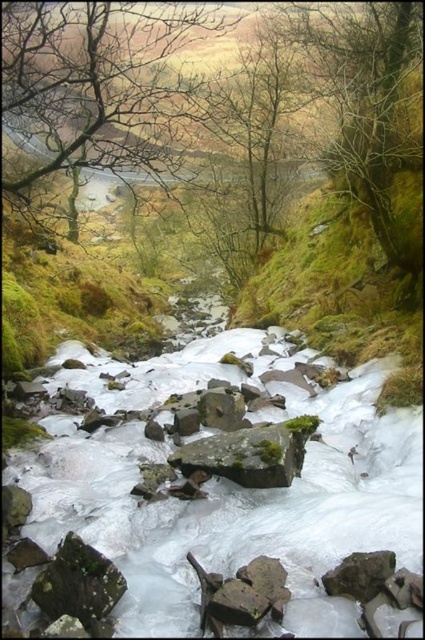
Which of these two, white frosty rocks at center or green mossy rock at center, stands taller?

green mossy rock at center is taller.

Does white frosty rocks at center lie in front of green mossy rock at center?

Yes, white frosty rocks at center is in front of green mossy rock at center.

The width and height of the screenshot is (425, 640). What do you see at coordinates (227, 486) in the screenshot?
I see `white frosty rocks at center` at bounding box center [227, 486].

The width and height of the screenshot is (425, 640). Identify the location of white frosty rocks at center. (227, 486).

Can you confirm if white frosty rocks at center is positioned to the right of mossy gray rock at lower left?

In fact, white frosty rocks at center is to the left of mossy gray rock at lower left.

Between white frosty rocks at center and mossy gray rock at lower left, which one is positioned lower?

white frosty rocks at center

Where is `white frosty rocks at center`? The image size is (425, 640). white frosty rocks at center is located at coordinates (227, 486).

Is brown leafless tree at upper left smaller than gray/rough stone at center?

No, brown leafless tree at upper left is not smaller than gray/rough stone at center.

Which is more to the left, brown leafless tree at upper left or gray/rough stone at center?

From the viewer's perspective, brown leafless tree at upper left appears more on the left side.

Who is more forward, (107, 112) or (243, 408)?

Point (107, 112) is in front.

Locate an element on the screen. brown leafless tree at upper left is located at coordinates (101, 84).